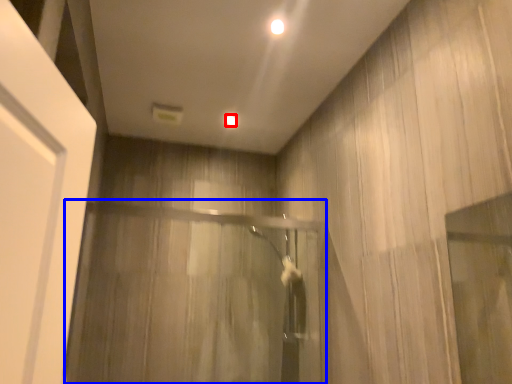
Question: Which point is closer to the camera, lighting (highlighted by a red box) or screen door (highlighted by a blue box)?

Choices:
 (A) lighting
 (B) screen door

Answer: (B)